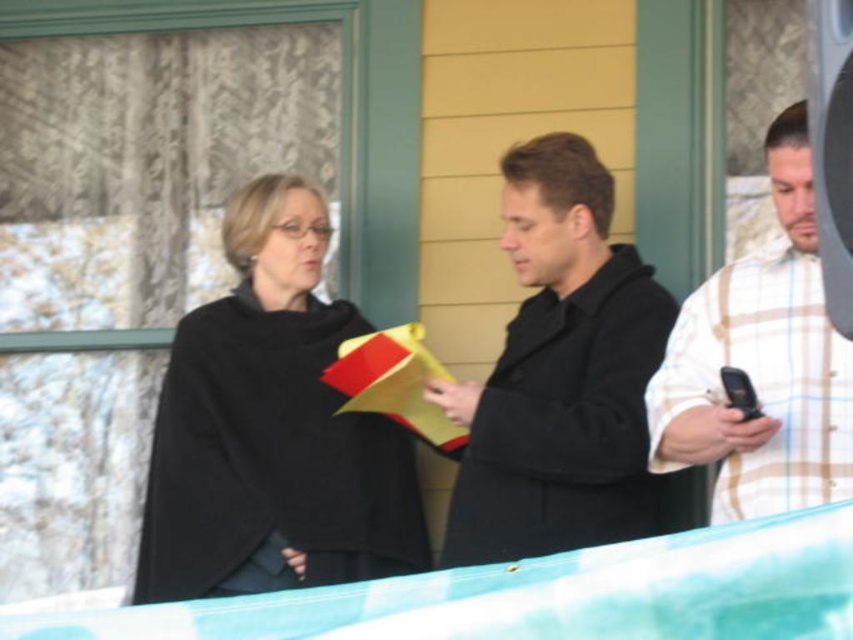
You are standing at the point with coordinates (271,429). Which object are you currently standing on?

You are standing on the black matte shawl at center.

You are standing in front of the building with a yellow wall and green trim. You see a matte black coat at center and a white plaid shirt at right. Which one is lower in position?

The matte black coat at center is below white plaid shirt at right, so the matte black coat at center is lower in position.